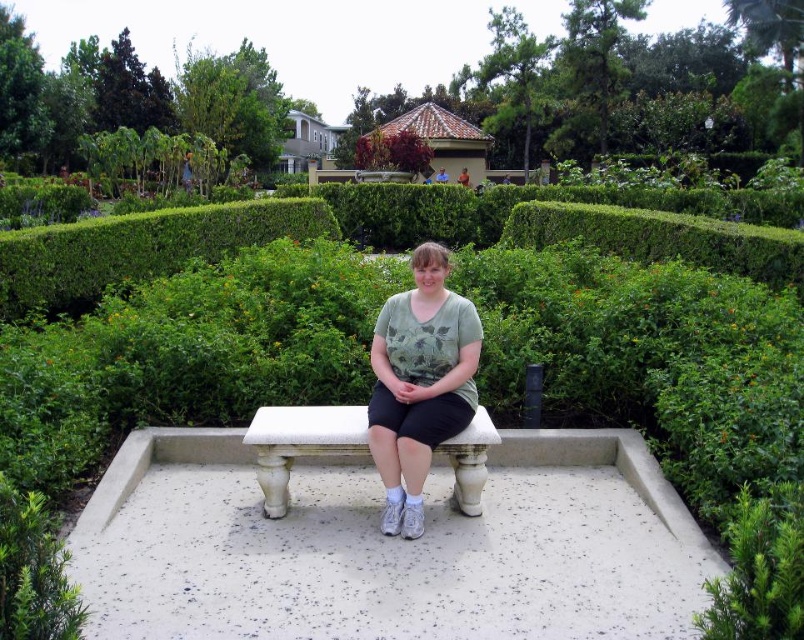
Question: Is green leafy bush at lower right bigger than white stone bench at center?

Choices:
 (A) yes
 (B) no

Answer: (A)

Question: Among these objects, which one is farthest from the camera?

Choices:
 (A) white speckled concrete bench at center
 (B) white stone bench at center
 (C) green leafy bush at lower right

Answer: (B)

Question: Which of the following is the closest to the observer?

Choices:
 (A) green leafy bush at lower right
 (B) white stone bench at center

Answer: (A)

Question: Considering the relative positions of green leafy bush at lower right and white stone bench at center in the image provided, where is green leafy bush at lower right located with respect to white stone bench at center?

Choices:
 (A) left
 (B) right

Answer: (B)

Question: Which object is farther from the camera taking this photo?

Choices:
 (A) green matte shirt at center
 (B) white stone bench at center
 (C) green leafy bush at lower right
 (D) white speckled concrete bench at center

Answer: (B)

Question: Is green leafy bush at lower right to the left of white stone bench at center from the viewer's perspective?

Choices:
 (A) no
 (B) yes

Answer: (A)